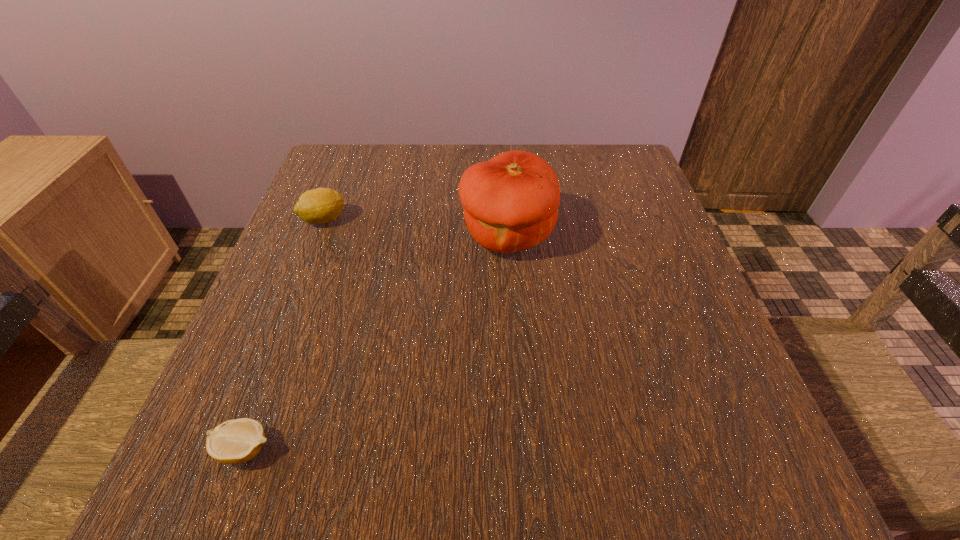
You are a GUI agent. You are given a task and a screenshot of the screen. Output one action in this format:
    pyautogui.click(x=<x>, y=<y>)
    Task: Click on the vacant space that satisfies the following two spatial constraints: 1. at the stem end of the farther lemon; 2. on the right side of the nearest object
    
    Given the screenshot: What is the action you would take?
    [234, 449]

The width and height of the screenshot is (960, 540). I want to click on free spot that satisfies the following two spatial constraints: 1. on the back side of the tallest object; 2. on the left side of the nearest object, so click(324, 235).

Image resolution: width=960 pixels, height=540 pixels. In order to click on vacant area in the image that satisfies the following two spatial constraints: 1. at the stem end of the taller lemon; 2. on the back side of the nearer lemon in this screenshot , I will do `click(234, 449)`.

You are a GUI agent. You are given a task and a screenshot of the screen. Output one action in this format:
    pyautogui.click(x=<x>, y=<y>)
    Task: Click on the blank area in the image that satisfies the following two spatial constraints: 1. at the stem end of the taller lemon; 2. on the right side of the tallest object
    
    Given the screenshot: What is the action you would take?
    pyautogui.click(x=318, y=235)

Find the location of a particular element. free spot that satisfies the following two spatial constraints: 1. at the stem end of the farther lemon; 2. on the left side of the nearer lemon is located at coordinates (234, 449).

Find the location of a particular element. vacant area that satisfies the following two spatial constraints: 1. at the stem end of the taller lemon; 2. on the left side of the rightmost object is located at coordinates (318, 235).

Where is `free space that satisfies the following two spatial constraints: 1. at the stem end of the shorter lemon; 2. on the left side of the taller lemon`? This screenshot has height=540, width=960. free space that satisfies the following two spatial constraints: 1. at the stem end of the shorter lemon; 2. on the left side of the taller lemon is located at coordinates (234, 449).

Locate an element on the screen. Image resolution: width=960 pixels, height=540 pixels. vacant space that satisfies the following two spatial constraints: 1. at the stem end of the second tallest object; 2. on the back side of the nearest object is located at coordinates (234, 449).

Find the location of a particular element. free region that satisfies the following two spatial constraints: 1. at the stem end of the taller lemon; 2. on the back side of the shortest object is located at coordinates (234, 449).

You are a GUI agent. You are given a task and a screenshot of the screen. Output one action in this format:
    pyautogui.click(x=<x>, y=<y>)
    Task: Click on the vacant position in the image that satisfies the following two spatial constraints: 1. at the stem end of the shorter lemon; 2. on the left side of the taller lemon
    The image size is (960, 540).
    Given the screenshot: What is the action you would take?
    pyautogui.click(x=234, y=449)